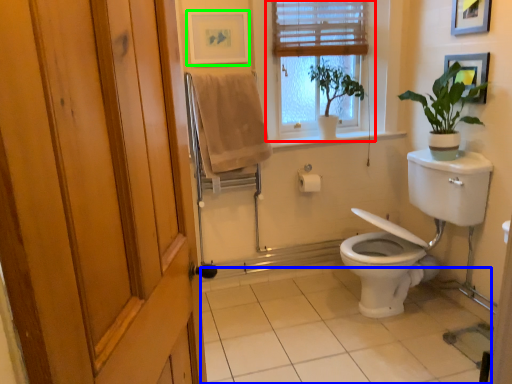
Question: Which is farther away from window (highlighted by a red box)? tile (highlighted by a blue box) or picture frame (highlighted by a green box)?

Choices:
 (A) tile
 (B) picture frame

Answer: (A)